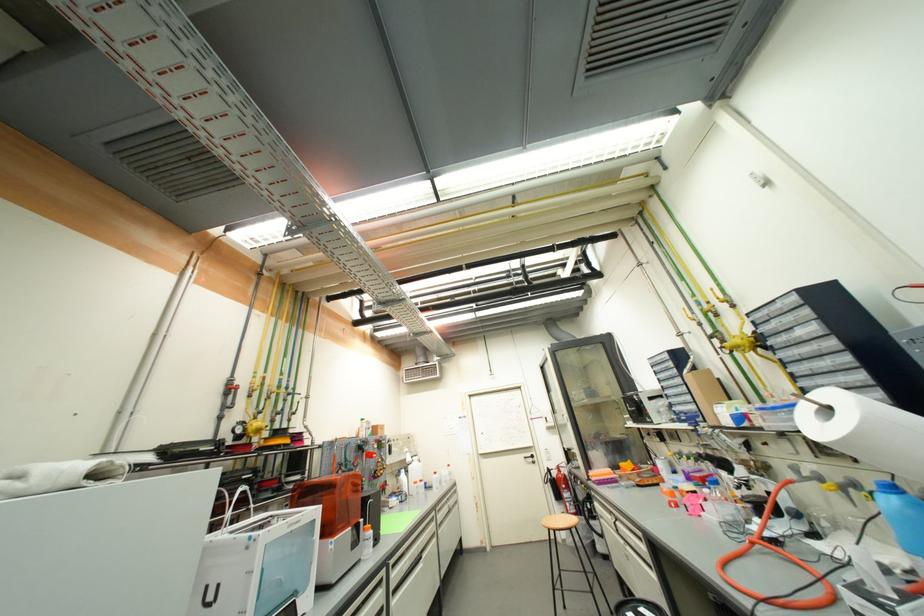
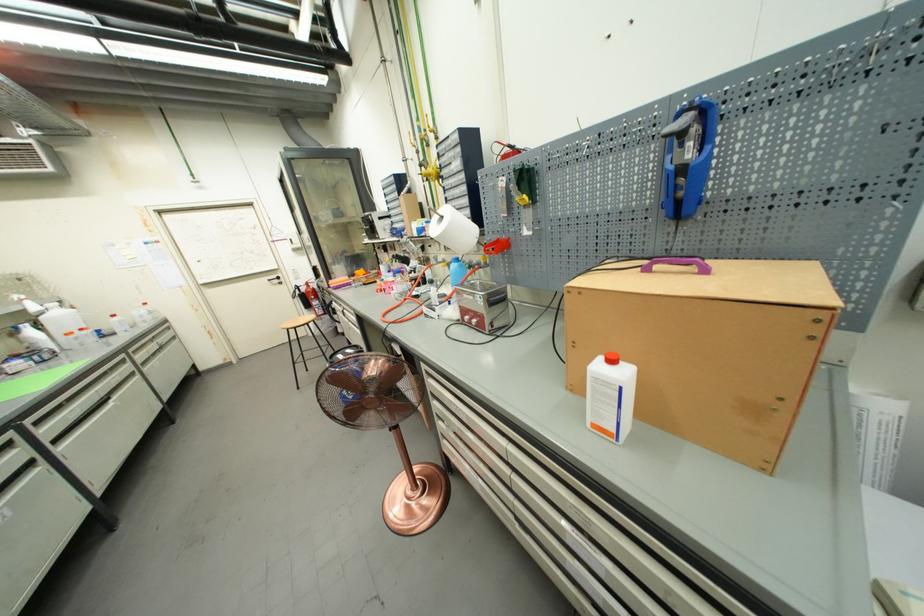
In the second image, find the point that corresponds to [550,525] in the first image.

(288, 329)